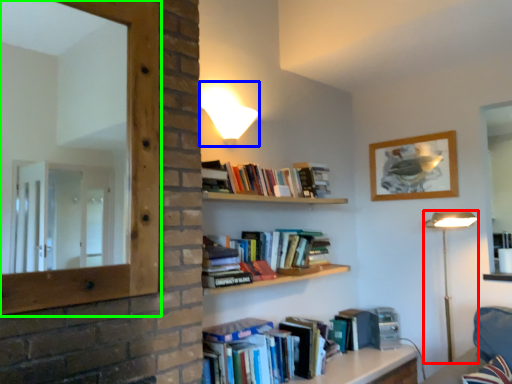
Question: Which is farther away from table lamp (highlighted by a red box)? lamp (highlighted by a blue box) or window frame (highlighted by a green box)?

Choices:
 (A) lamp
 (B) window frame

Answer: (B)